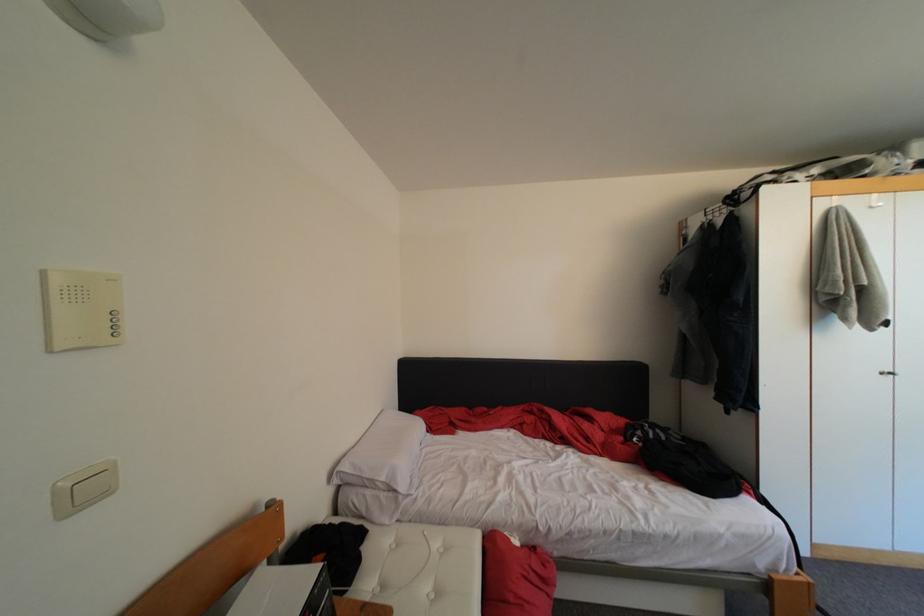
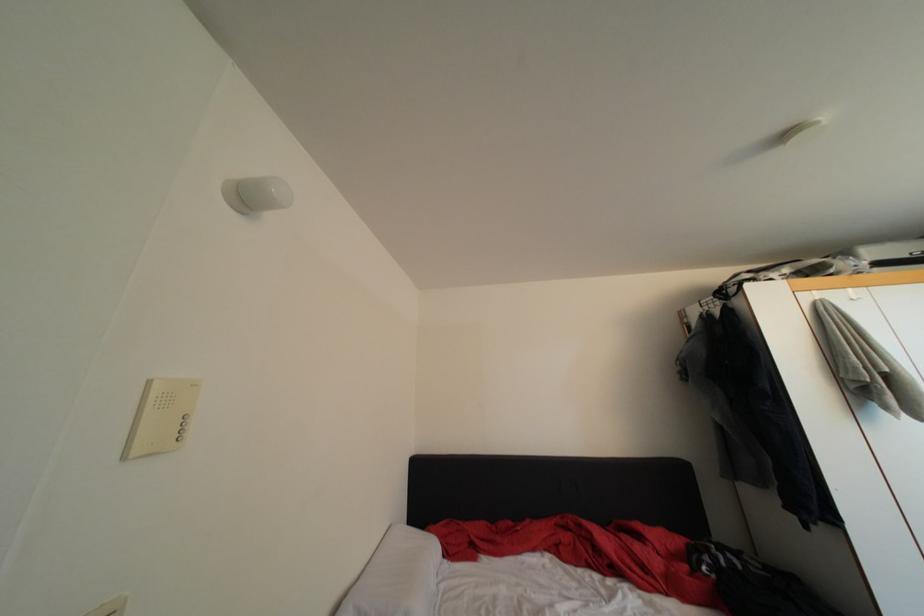
Question: Based on the continuous images, in which direction is the camera rotating? Reply with the corresponding letter.

Choices:
 (A) Left
 (B) Right
 (C) Up
 (D) Down

Answer: (C)